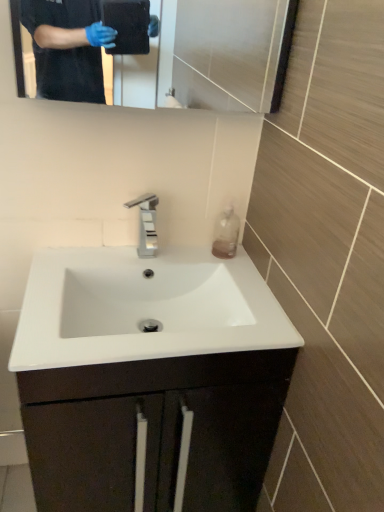
Question: In terms of height, does glossy metallic mirror at upper center look taller or shorter compared to white glossy sink at center?

Choices:
 (A) short
 (B) tall

Answer: (A)

Question: Based on their sizes in the image, would you say glossy metallic mirror at upper center is bigger or smaller than white glossy sink at center?

Choices:
 (A) big
 (B) small

Answer: (B)

Question: Estimate the real-world distances between objects in this image. Which object is farther from the white glossy sink at center?

Choices:
 (A) glossy metallic mirror at upper center
 (B) white glossy sink at center
 (C) translucent plastic bottle at right

Answer: (A)

Question: Estimate the real-world distances between objects in this image. Which object is closer to the white glossy sink at center?

Choices:
 (A) white glossy sink at center
 (B) glossy metallic mirror at upper center
 (C) translucent plastic bottle at right

Answer: (A)